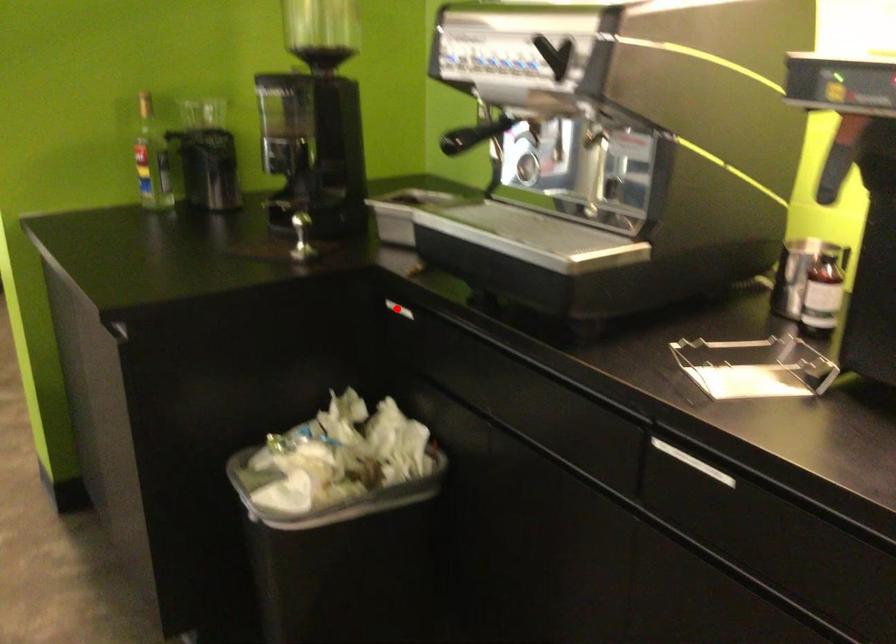
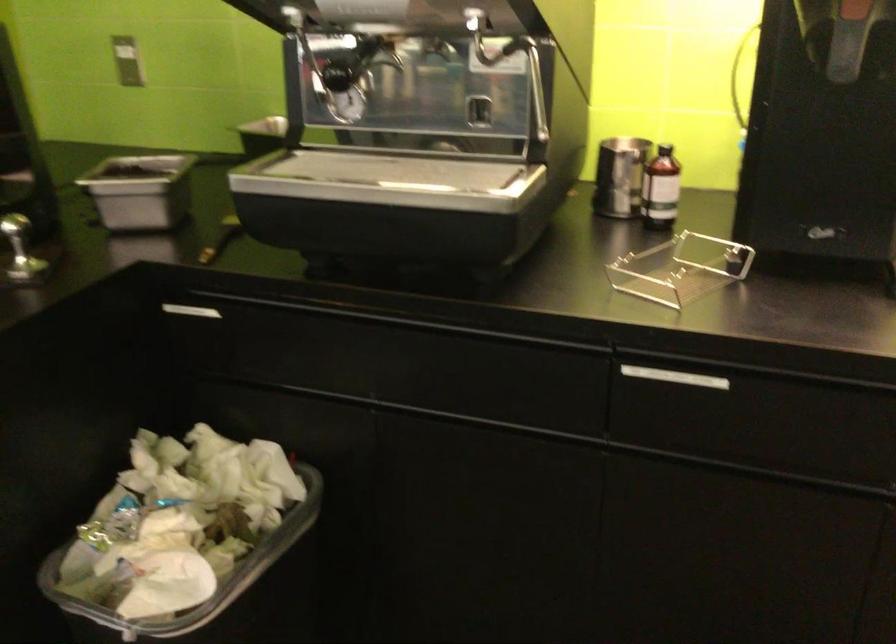
Question: I am providing you with two images of the same scene from different viewpoints. Image1 has a red point marked. In image2, the corresponding 3D location appears at what relative position? Reply with the corresponding letter.

Choices:
 (A) Closer
 (B) Farther

Answer: (A)